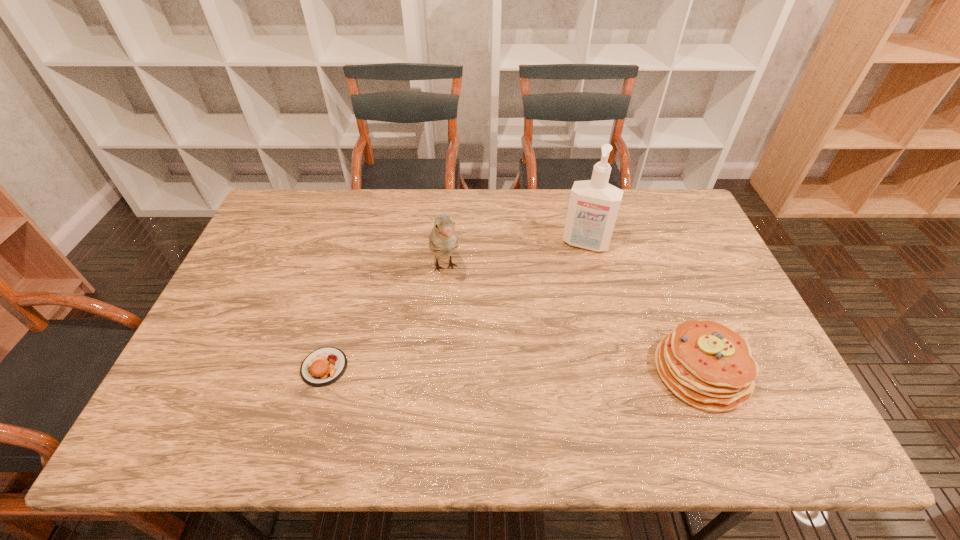
The width and height of the screenshot is (960, 540). Identify the location of object that is at the near right corner. (707, 365).

Locate an element on the screen. The image size is (960, 540). vacant area at the near edge of the desktop is located at coordinates (282, 380).

Find the location of `vacant area at the left edge`. vacant area at the left edge is located at coordinates (281, 246).

You are a GUI agent. You are given a task and a screenshot of the screen. Output one action in this format:
    pyautogui.click(x=<x>, y=<y>)
    Task: Click on the vacant space at the right edge of the desktop
    The height and width of the screenshot is (540, 960).
    Given the screenshot: What is the action you would take?
    pyautogui.click(x=686, y=272)

Where is `vacant space at the near left corner of the desktop`? The width and height of the screenshot is (960, 540). vacant space at the near left corner of the desktop is located at coordinates (195, 404).

Image resolution: width=960 pixels, height=540 pixels. I want to click on empty location between the pancake and the patty (food), so click(513, 369).

This screenshot has height=540, width=960. Identify the location of free space between the cleansing agent and the third object from right to left. (516, 255).

In order to click on vacant area that lies between the cleansing agent and the shortest object in this screenshot , I will do `click(455, 305)`.

Where is `free space between the third object from right to left and the leftmost object`? The height and width of the screenshot is (540, 960). free space between the third object from right to left and the leftmost object is located at coordinates (385, 318).

Where is `free area in between the tallest object and the leftmost object`? Image resolution: width=960 pixels, height=540 pixels. free area in between the tallest object and the leftmost object is located at coordinates (455, 305).